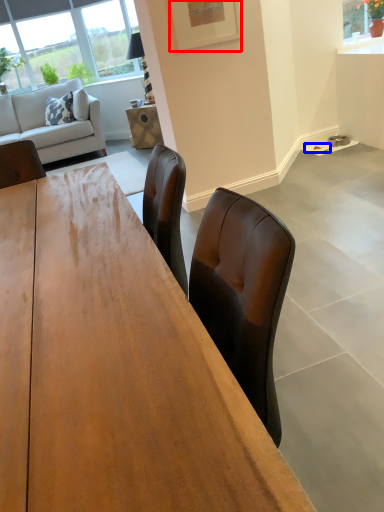
Question: Which of the following is the closest to the observer, picture frame (highlighted by a red box) or plate (highlighted by a blue box)?

Choices:
 (A) picture frame
 (B) plate

Answer: (A)